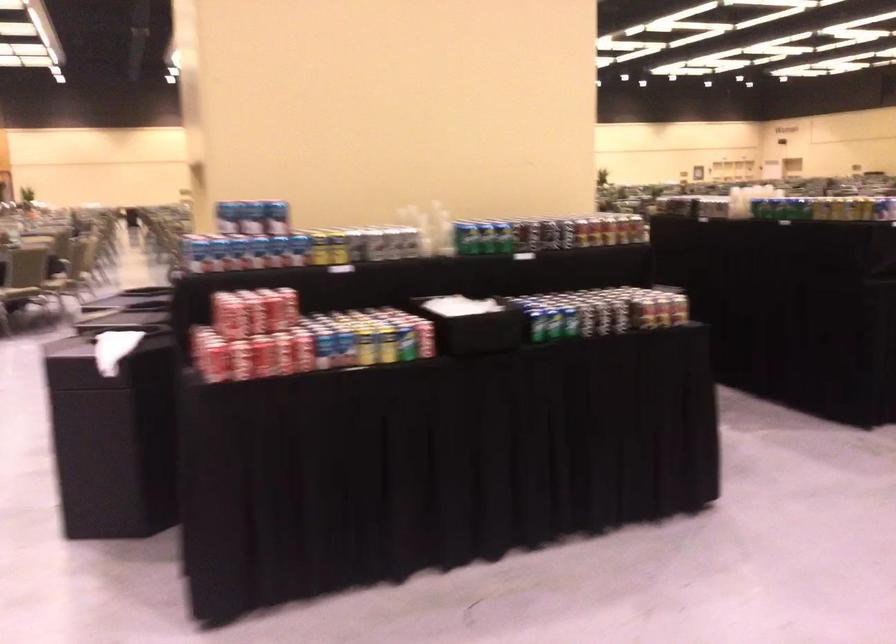
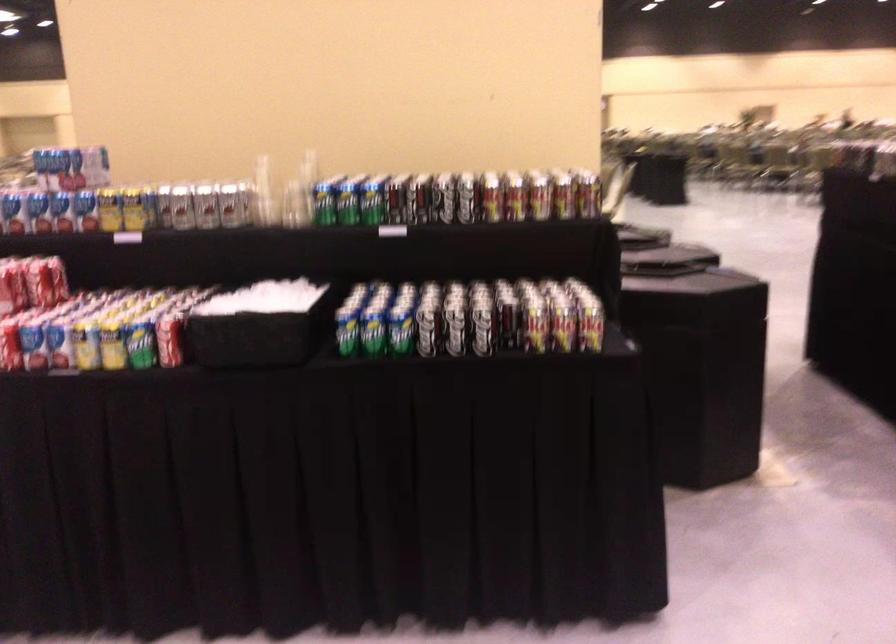
Find the pixel in the second image that matches point 380,348 in the first image.

(112, 346)